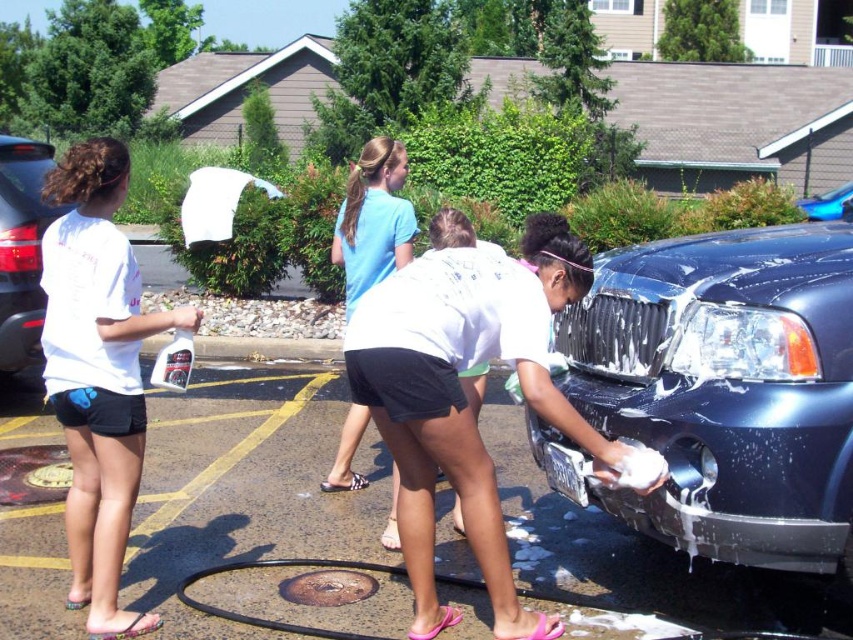
You are standing in the parking lot and see two points marked in the image. Which point is closer to you, point (36, 332) or point (831, 208)?

Point (36, 332) is closer to the viewer than point (831, 208).

Based on the scene description, which car is taller, the matte black car at left or the glossy blue car at right?

The glossy blue car at right is taller than the matte black car at left.